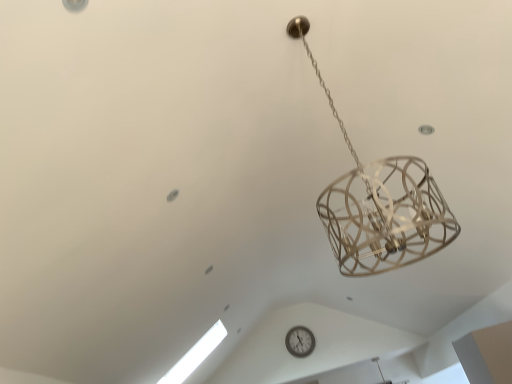
Question: In terms of width, does transparent glass window at lower left look wider or thinner when compared to white plastic wall clock at center?

Choices:
 (A) thin
 (B) wide

Answer: (B)

Question: Is transparent glass window at lower left to the left or to the right of white plastic wall clock at center in the image?

Choices:
 (A) right
 (B) left

Answer: (B)

Question: Looking at the image, does transparent glass window at lower left seem bigger or smaller compared to white plastic wall clock at center?

Choices:
 (A) small
 (B) big

Answer: (B)

Question: Considering the positions of white plastic wall clock at center and transparent glass window at lower left in the image, is white plastic wall clock at center wider or thinner than transparent glass window at lower left?

Choices:
 (A) thin
 (B) wide

Answer: (A)

Question: Is white plastic wall clock at center spatially inside transparent glass window at lower left, or outside of it?

Choices:
 (A) inside
 (B) outside

Answer: (B)

Question: From their relative heights in the image, would you say white plastic wall clock at center is taller or shorter than transparent glass window at lower left?

Choices:
 (A) short
 (B) tall

Answer: (A)

Question: Is point (287, 336) positioned closer to the camera than point (197, 349)?

Choices:
 (A) closer
 (B) farther

Answer: (B)